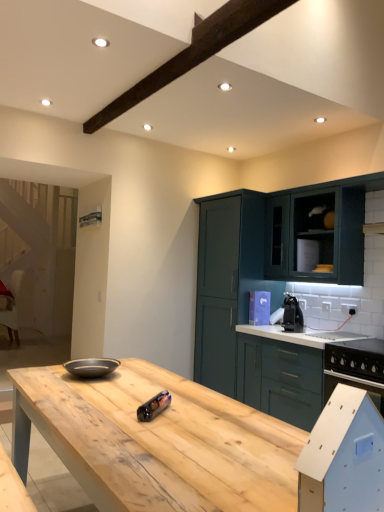
Question: Is metallic cylindrical can at center, marked as the 1th appliance in a bottom-to-top arrangement, far away from green matte cabinet at right, which appears as the third cabinetry when viewed from the back?

Choices:
 (A) yes
 (B) no

Answer: (A)

Question: Does metallic cylindrical can at center, marked as the 1th appliance in a bottom-to-top arrangement, have a larger size compared to green matte cabinet at right, which appears as the third cabinetry when viewed from the back?

Choices:
 (A) yes
 (B) no

Answer: (B)

Question: Considering the relative sizes of metallic cylindrical can at center, which ranks as the second appliance in right-to-left order, and green matte cabinet at right, which appears as the third cabinetry when viewed from the back, in the image provided, is metallic cylindrical can at center, which ranks as the second appliance in right-to-left order, wider than green matte cabinet at right, which appears as the third cabinetry when viewed from the back,?

Choices:
 (A) no
 (B) yes

Answer: (A)

Question: Does metallic cylindrical can at center, the 1th appliance in the front-to-back sequence, contain green matte cabinet at right, which appears as the third cabinetry when viewed from the back?

Choices:
 (A) yes
 (B) no

Answer: (B)

Question: Is metallic cylindrical can at center, which ranks as the second appliance in right-to-left order, next to green matte cabinet at right, marked as the first cabinetry in a front-to-back arrangement, and touching it?

Choices:
 (A) yes
 (B) no

Answer: (B)

Question: Is metallic cylindrical can at center, the second appliance when ordered from top to bottom, taller or shorter than teal matte cabinet at upper right, which is counted as the first cabinetry, starting from the back?

Choices:
 (A) short
 (B) tall

Answer: (A)

Question: Is metallic cylindrical can at center, the 1th appliance in the front-to-back sequence, bigger or smaller than teal matte cabinet at upper right, the third cabinetry when ordered from front to back?

Choices:
 (A) small
 (B) big

Answer: (A)

Question: Which is correct: metallic cylindrical can at center, placed as the 1th appliance when sorted from left to right, is inside teal matte cabinet at upper right, the third cabinetry when ordered from front to back, or outside of it?

Choices:
 (A) outside
 (B) inside

Answer: (A)

Question: From a real-world perspective, is metallic cylindrical can at center, placed as the 1th appliance when sorted from left to right, above or below teal matte cabinet at upper right, which is counted as the first cabinetry, starting from the back?

Choices:
 (A) above
 (B) below

Answer: (B)

Question: From the image's perspective, is white fabric chair at left above or below matte dark teal cabinet at upper right, which appears as the 2th cabinetry when viewed from the front?

Choices:
 (A) below
 (B) above

Answer: (A)

Question: From a real-world perspective, is white fabric chair at left positioned above or below matte dark teal cabinet at upper right, marked as the second cabinetry in a back-to-front arrangement?

Choices:
 (A) above
 (B) below

Answer: (B)

Question: In terms of size, does white fabric chair at left appear bigger or smaller than matte dark teal cabinet at upper right, which appears as the 2th cabinetry when viewed from the front?

Choices:
 (A) big
 (B) small

Answer: (A)

Question: In terms of height, does white fabric chair at left look taller or shorter compared to matte dark teal cabinet at upper right, which appears as the 2th cabinetry when viewed from the front?

Choices:
 (A) short
 (B) tall

Answer: (B)

Question: Do you think matte dark teal cabinet at upper right, which appears as the 2th cabinetry when viewed from the front, is within black plastic coffee machine at center, which is counted as the 2th appliance, starting from the left, or outside of it?

Choices:
 (A) outside
 (B) inside

Answer: (A)

Question: Considering their positions, is matte dark teal cabinet at upper right, marked as the second cabinetry in a back-to-front arrangement, located in front of or behind black plastic coffee machine at center, the 1th appliance positioned from the right?

Choices:
 (A) front
 (B) behind

Answer: (A)